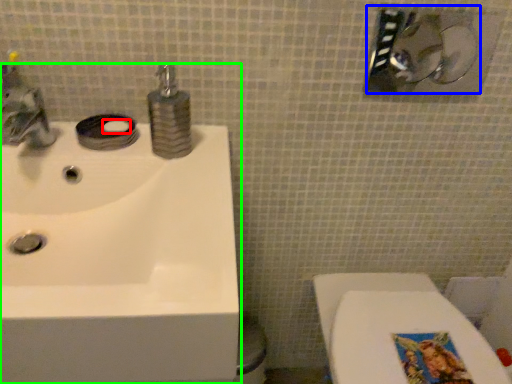
Question: Estimate the real-world distances between objects in this image. Which object is closer to soap (highlighted by a red box), shower (highlighted by a blue box) or sink (highlighted by a green box)?

Choices:
 (A) shower
 (B) sink

Answer: (B)